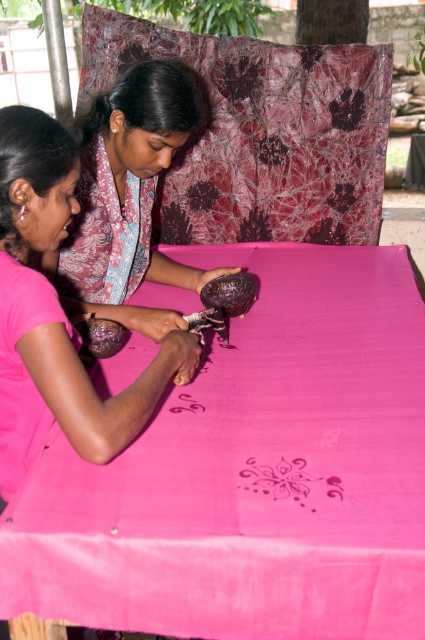
You are a tailor who needs to choose between two pink materials for a project. You have a pink silk scarf at upper left and a pink fabric at lower left. Which material has a greater width?

The pink silk scarf at upper left has a greater width than the pink fabric at lower left.

You are a batik artisan working on a pink silk scarf at upper left. You need to place a new pattern at point (107, 234). Is this point located on the pink silk scarf at upper left?

Yes, the point (107, 234) is located on the pink silk scarf at upper left according to the description.